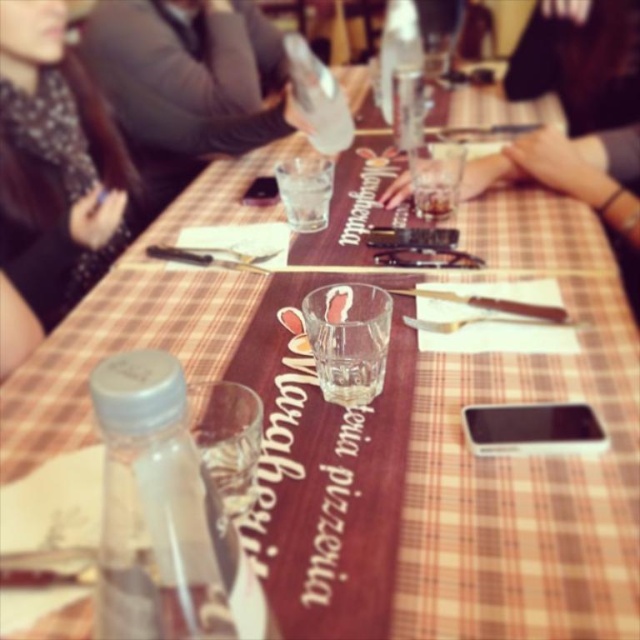
Question: Is black fabric scarf at upper left thinner than translucent glass at center?

Choices:
 (A) yes
 (B) no

Answer: (B)

Question: Does black fabric scarf at upper left have a larger size compared to translucent glass at center?

Choices:
 (A) yes
 (B) no

Answer: (A)

Question: Which point is closer to the camera?

Choices:
 (A) black fabric scarf at upper left
 (B) translucent glass at center

Answer: (A)

Question: Which of the following is the farthest from the observer?

Choices:
 (A) (52, 320)
 (B) (433, 218)

Answer: (B)

Question: Among these objects, which one is nearest to the camera?

Choices:
 (A) black fabric scarf at upper left
 (B) translucent glass at center

Answer: (A)

Question: From the image, what is the correct spatial relationship of black fabric scarf at upper left in relation to translucent glass at center?

Choices:
 (A) above
 (B) below

Answer: (A)